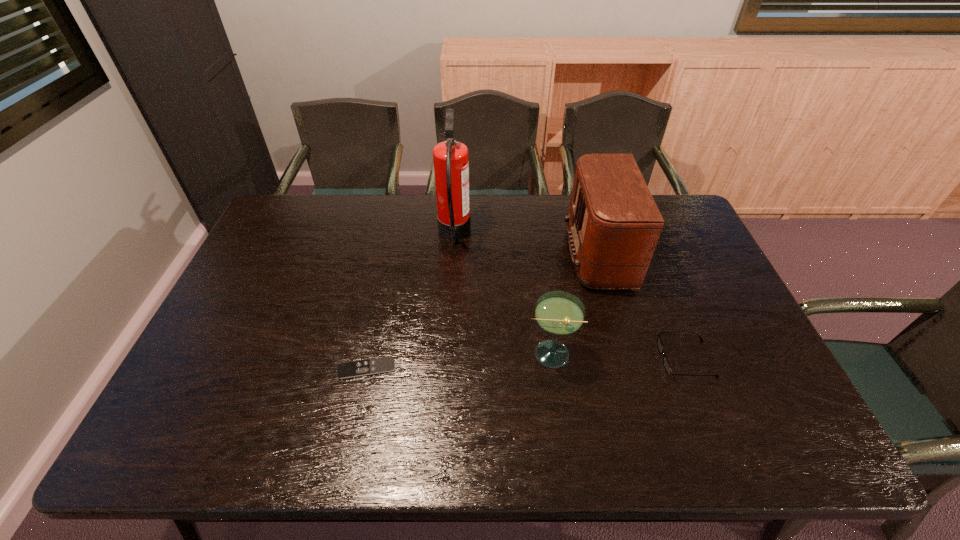
Where is `vacant area in the image that satisfies the following two spatial constraints: 1. on the front-facing side of the fire extinguisher; 2. on the back side of the third tallest object`? The width and height of the screenshot is (960, 540). vacant area in the image that satisfies the following two spatial constraints: 1. on the front-facing side of the fire extinguisher; 2. on the back side of the third tallest object is located at coordinates (446, 354).

Where is `free space that satisfies the following two spatial constraints: 1. on the front-facing side of the fourth object from right to left; 2. on the back side of the martini`? free space that satisfies the following two spatial constraints: 1. on the front-facing side of the fourth object from right to left; 2. on the back side of the martini is located at coordinates (446, 354).

The image size is (960, 540). Identify the location of vacant space that satisfies the following two spatial constraints: 1. on the front panel of the fourth shortest object; 2. on the front side of the remote control. (649, 368).

Find the location of a particular element. blank area in the image that satisfies the following two spatial constraints: 1. on the front-facing side of the fire extinguisher; 2. on the front side of the leftmost object is located at coordinates 445,368.

I want to click on vacant area that satisfies the following two spatial constraints: 1. on the front-facing side of the third object from left to right; 2. on the right side of the second object from left to right, so click(446, 354).